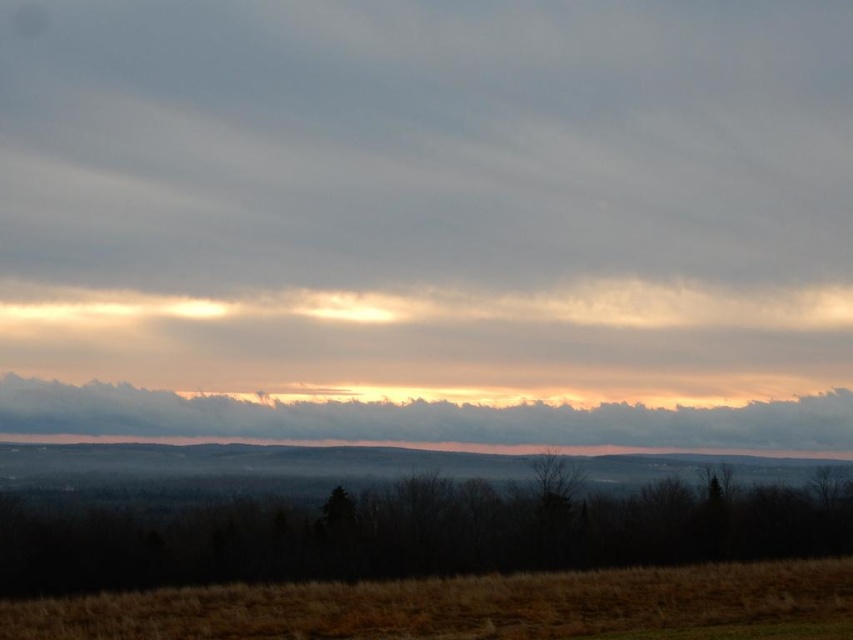
Question: Where is brown grass at lower center located in relation to cloudy at upper center in the image?

Choices:
 (A) right
 (B) left

Answer: (A)

Question: Does brown grass at lower center have a smaller size compared to cloudy at upper center?

Choices:
 (A) no
 (B) yes

Answer: (B)

Question: Does brown grass at lower center have a lesser width compared to cloudy at upper center?

Choices:
 (A) no
 (B) yes

Answer: (B)

Question: Which point appears farthest from the camera in this image?

Choices:
 (A) [x=489, y=620]
 (B) [x=136, y=417]

Answer: (B)